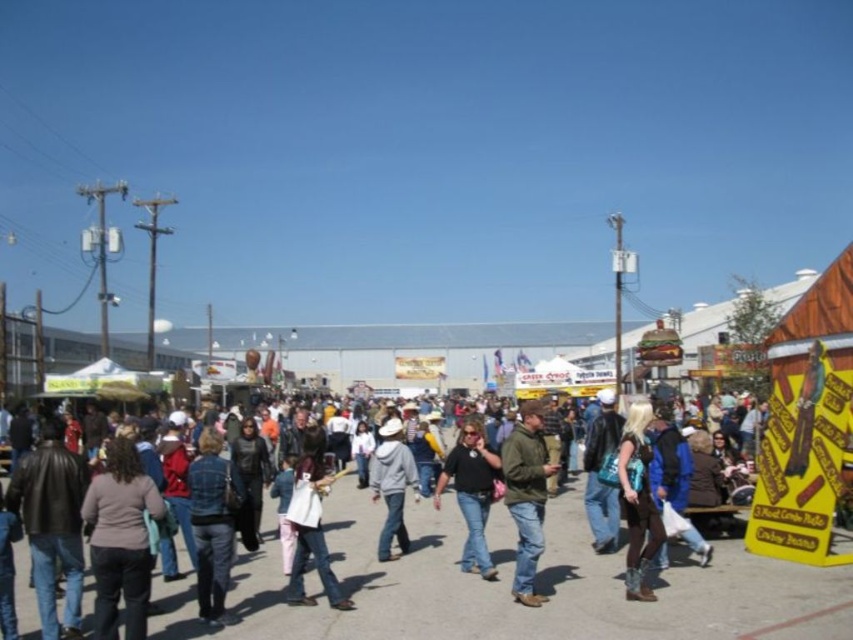
Can you confirm if denim jeans at center is taller than green matte jacket at center?

In fact, denim jeans at center may be shorter than green matte jacket at center.

Who is shorter, denim jeans at center or green matte jacket at center?

denim jeans at center is shorter.

Who is more distant from viewer, (454, 627) or (526, 432)?

The point (526, 432) is behind.

The image size is (853, 640). Identify the location of denim jeans at center. (480, 586).

Does teal fabric purse at lower right have a larger size compared to denim jacket at center?

No.

Does point (637, 474) come closer to viewer compared to point (614, 508)?

Yes, it is.

Where is `teal fabric purse at lower right`? This screenshot has width=853, height=640. teal fabric purse at lower right is located at coordinates (637, 502).

Does denim jeans at center appear over denim jacket at center?

Actually, denim jeans at center is below denim jacket at center.

At what (x,y) coordinates should I click in order to perform the action: click on denim jeans at center. Please return your answer as a coordinate pair (x, y). This screenshot has height=640, width=853. Looking at the image, I should click on (480, 586).

The height and width of the screenshot is (640, 853). Identify the location of denim jeans at center. (480, 586).